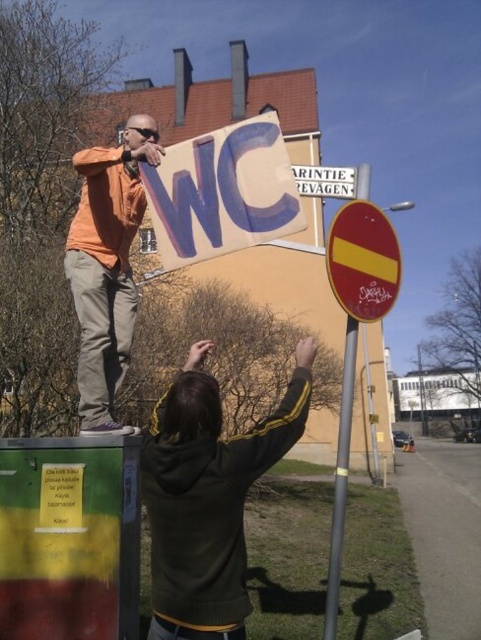
Which is behind, point (256, 426) or point (124, 218)?

The point (124, 218) is more distant.

Between dark green hoodie at center and orange matte jacket at upper left, which one is positioned lower?

Positioned lower is dark green hoodie at center.

At what (x,y) coordinates should I click in order to perform the action: click on dark green hoodie at center. Please return your answer as a coordinate pair (x, y). The height and width of the screenshot is (640, 481). Looking at the image, I should click on (207, 497).

This screenshot has height=640, width=481. Identify the location of dark green hoodie at center. (207, 497).

Does orange matte jacket at upper left have a smaller size compared to white plastic sign at upper center?

No, orange matte jacket at upper left is not smaller than white plastic sign at upper center.

Does orange matte jacket at upper left have a lesser height compared to white plastic sign at upper center?

Incorrect, orange matte jacket at upper left's height does not fall short of white plastic sign at upper center's.

Who is more distant from viewer, (123, 323) or (308, 168)?

The point (308, 168) is behind.

Identify the location of orange matte jacket at upper left. (106, 266).

Between dark green hoodie at center and metallic reflective sign at center, which one has less height?

With less height is metallic reflective sign at center.

Which is below, dark green hoodie at center or metallic reflective sign at center?

Positioned lower is dark green hoodie at center.

You are a GUI agent. You are given a task and a screenshot of the screen. Output one action in this format:
    pyautogui.click(x=<x>, y=<y>)
    Task: Click on the dark green hoodie at center
    Image resolution: width=481 pixels, height=640 pixels.
    Given the screenshot: What is the action you would take?
    pyautogui.click(x=207, y=497)